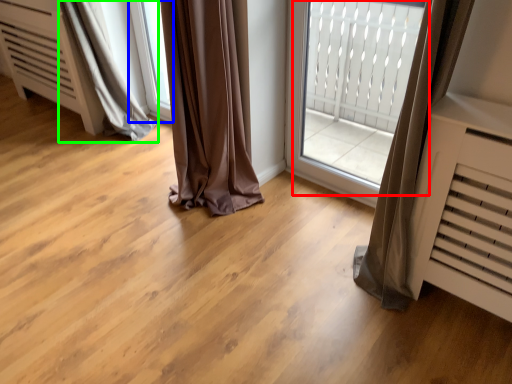
Question: Which is nearer to the bay window (highlighted by a red box)? window (highlighted by a blue box) or curtain (highlighted by a green box).

Choices:
 (A) window
 (B) curtain

Answer: (A)